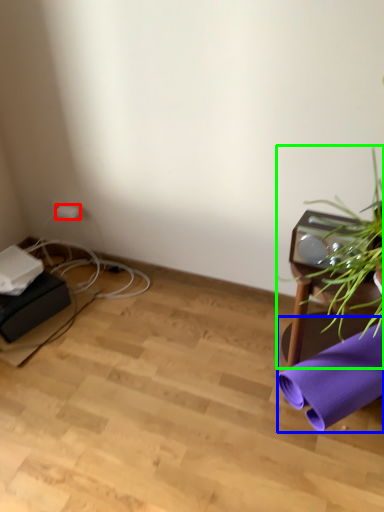
Question: Which object is the farthest from plug (highlighted by a red box)? Choose among these: beach towel (highlighted by a blue box) or houseplant (highlighted by a green box).

Choices:
 (A) beach towel
 (B) houseplant

Answer: (A)